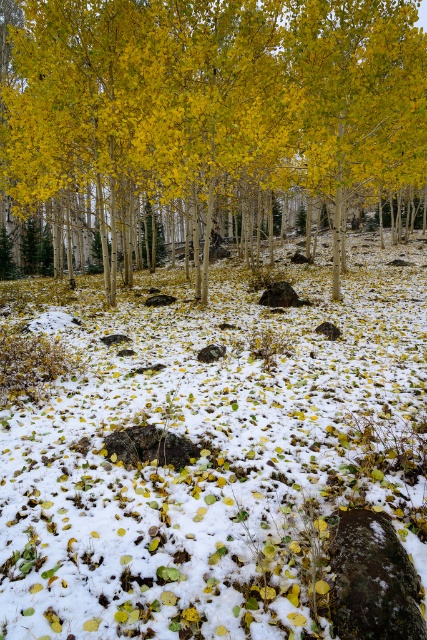
Question: In this image, where is white fluffy snow at center located relative to yellow matte tree at center?

Choices:
 (A) below
 (B) above

Answer: (A)

Question: Among these points, which one is nearest to the camera?

Choices:
 (A) (377, 106)
 (B) (87, 438)

Answer: (B)

Question: Which object appears closest to the camera in this image?

Choices:
 (A) white fluffy snow at center
 (B) yellow matte tree at center

Answer: (A)

Question: Does white fluffy snow at center come in front of yellow matte tree at center?

Choices:
 (A) yes
 (B) no

Answer: (A)

Question: Is white fluffy snow at center to the left of yellow matte tree at center from the viewer's perspective?

Choices:
 (A) yes
 (B) no

Answer: (A)

Question: Which point appears farthest from the camera in this image?

Choices:
 (A) (403, 80)
 (B) (11, 424)

Answer: (A)